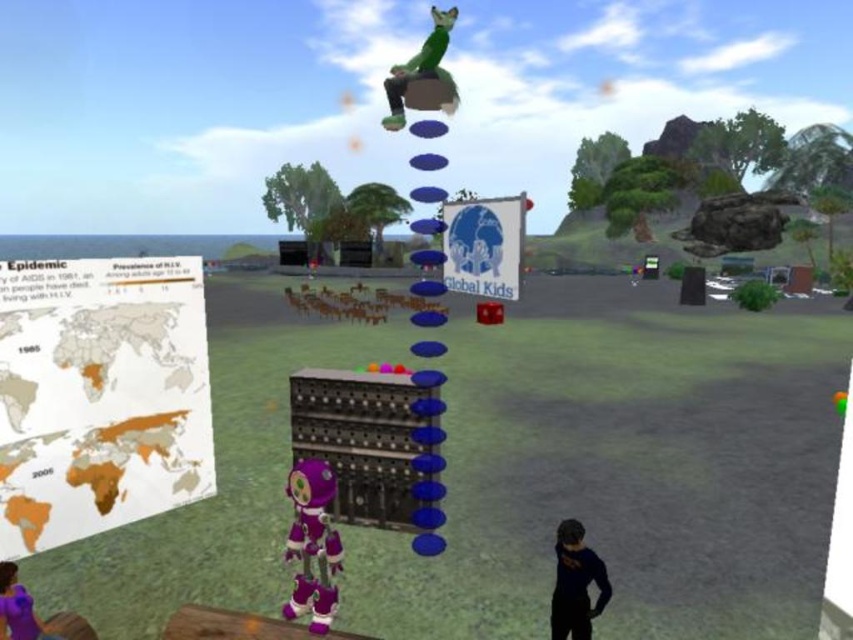
Question: Does green matte fur at upper center appear on the left side of brown matte horse at center?

Choices:
 (A) yes
 (B) no

Answer: (B)

Question: Which object appears farthest from the camera in this image?

Choices:
 (A) brown matte horse at center
 (B) green matte fur at upper center
 (C) purple fabric person at lower left

Answer: (B)

Question: Does green matte fur at upper center come in front of purple fabric person at lower left?

Choices:
 (A) no
 (B) yes

Answer: (A)

Question: Among these points, which one is nearest to the camera?

Choices:
 (A) (9, 616)
 (B) (434, 84)
 (C) (436, 301)
 (D) (608, 593)

Answer: (A)

Question: Which point appears closest to the camera in this image?

Choices:
 (A) (438, 68)
 (B) (355, 292)
 (C) (585, 588)
 (D) (36, 616)

Answer: (D)

Question: Does brown matte horse at center appear on the right side of purple fabric person at lower left?

Choices:
 (A) yes
 (B) no

Answer: (A)